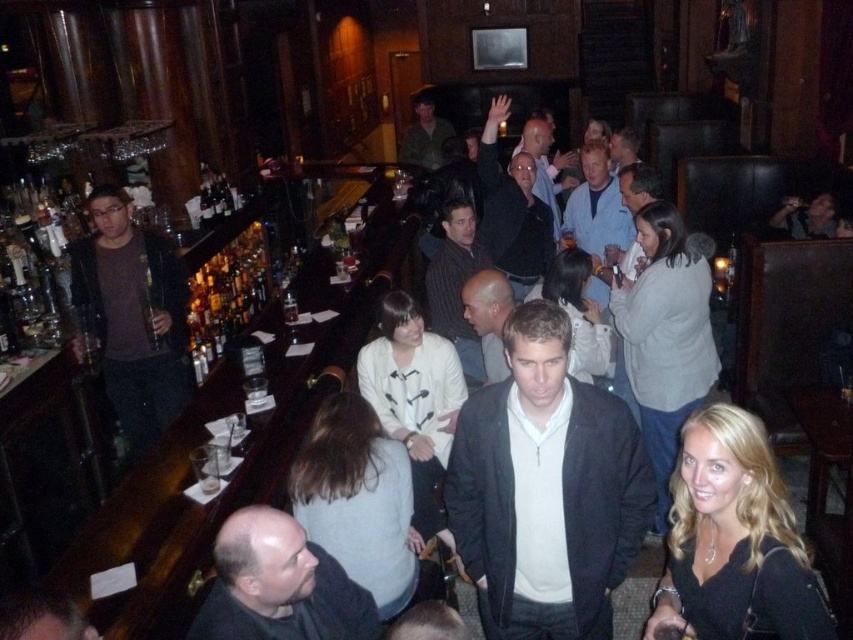
Who is lower down, matte black jacket at center or light brown hair at center?

matte black jacket at center is lower down.

Between matte black jacket at center and light brown hair at center, which one is positioned higher?

light brown hair at center is above.

Who is more distant from viewer, (525,314) or (605,328)?

Positioned behind is point (605,328).

Locate an element on the screen. matte black jacket at center is located at coordinates (544, 490).

Is dark gray sweater at lower left wider than dark blue sweater at center?

In fact, dark gray sweater at lower left might be narrower than dark blue sweater at center.

Is point (332, 586) closer to viewer compared to point (502, 269)?

Yes, point (332, 586) is in front of point (502, 269).

The width and height of the screenshot is (853, 640). What are the coordinates of `dark gray sweater at lower left` in the screenshot? It's located at (279, 586).

Is the position of matte brown jacket at left less distant than that of dark blue sweater at center?

Yes, matte brown jacket at left is closer to the viewer.

Who is more forward, [183,300] or [534,214]?

Positioned in front is point [183,300].

Identify the location of matte brown jacket at left. This screenshot has height=640, width=853. (132, 316).